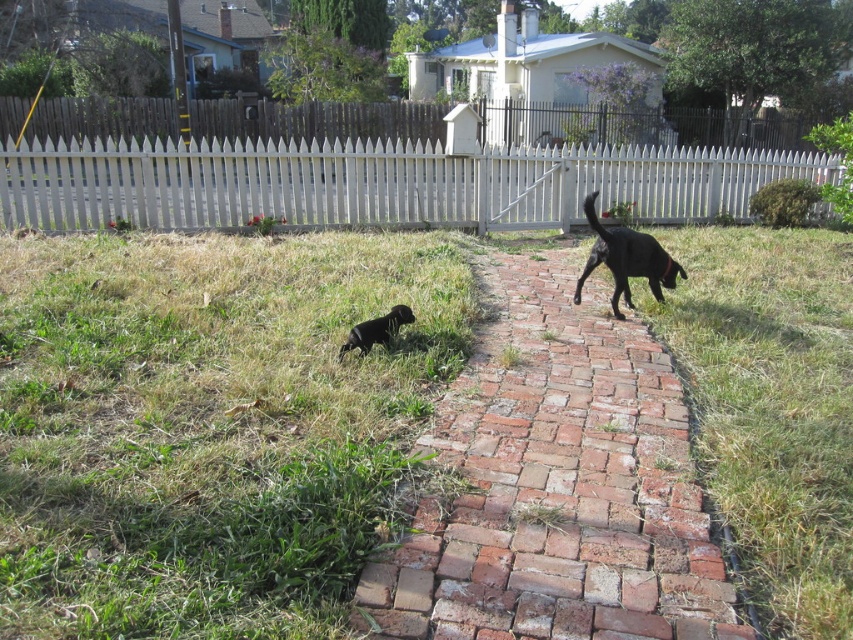
You are standing at the point marked by the coordinates point [556,484] in the image. According to the scene description, what material are you standing on?

The point [556,484] is on brick at center, so you are standing on brick material.

In the scene shown: You are standing at the point marked by the coordinates point (207, 426) in the image. Looking around, you see the worn brick pathway leading towards the white picket fence. Which direction should you walk to reach the green grass at lower left?

The point (207, 426) is already at the green grass at lower left, so you are already there.